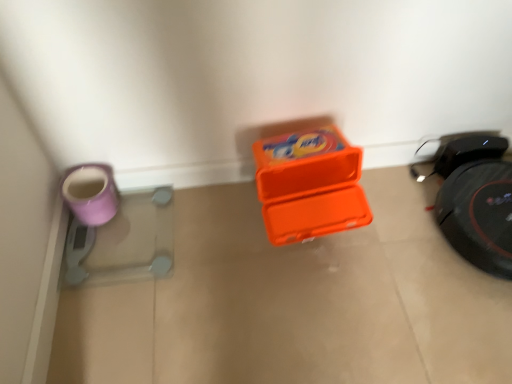
Describe the element at coordinates (294, 303) in the screenshot. This screenshot has height=384, width=512. I see `orange plastic container at center` at that location.

Image resolution: width=512 pixels, height=384 pixels. I want to click on orange plastic container at center, so click(294, 303).

Measure the distance between point [76,201] and camera.

They are 1.14 meters apart.

In order to click on matte purple mug at left in this screenshot , I will do `click(91, 193)`.

This screenshot has height=384, width=512. What do you see at coordinates (91, 193) in the screenshot?
I see `matte purple mug at left` at bounding box center [91, 193].

Identify the location of orange plastic container at center. (294, 303).

Does matte purple mug at left appear on the right side of orange plastic container at center?

Incorrect, matte purple mug at left is not on the right side of orange plastic container at center.

Between matte purple mug at left and orange plastic container at center, which one is positioned in front?

orange plastic container at center is in front.

Does point (93, 211) come behind point (159, 320)?

Yes, point (93, 211) is farther from viewer.

From the image's perspective, does matte purple mug at left appear higher than orange plastic container at center?

Indeed, from the image's perspective, matte purple mug at left is shown above orange plastic container at center.

From a real-world perspective, relative to orange plastic container at center, is matte purple mug at left vertically above or below?

In terms of real-world spatial position, matte purple mug at left is above orange plastic container at center.

Considering the relative sizes of matte purple mug at left and orange plastic container at center in the image provided, is matte purple mug at left wider than orange plastic container at center?

Incorrect, the width of matte purple mug at left does not surpass that of orange plastic container at center.

Who is taller, matte purple mug at left or orange plastic container at center?

matte purple mug at left is taller.

Does matte purple mug at left have a smaller size compared to orange plastic container at center?

Indeed, matte purple mug at left has a smaller size compared to orange plastic container at center.

Would you say matte purple mug at left is outside orange plastic container at center?

matte purple mug at left is positioned outside orange plastic container at center.

Would you consider matte purple mug at left to be distant from orange plastic container at center?

Actually, matte purple mug at left and orange plastic container at center are a little close together.

Is matte purple mug at left turned away from orange plastic container at center?

matte purple mug at left is not turned away from orange plastic container at center.

Identify the location of footwear above the orange plastic container at center (from a real-world perspective). This screenshot has width=512, height=384. (91, 193).

From the picture: Considering the positions of objects orange plastic container at center and matte purple mug at left in the image provided, who is more to the right, orange plastic container at center or matte purple mug at left?

Positioned to the right is orange plastic container at center.

Which is in front, orange plastic container at center or matte purple mug at left?

Positioned in front is orange plastic container at center.

Considering the points (145, 331) and (81, 201), which point is behind, point (145, 331) or point (81, 201)?

Point (81, 201)

From the image's perspective, is orange plastic container at center located above or below matte purple mug at left?

From the image's perspective, orange plastic container at center appears below matte purple mug at left.

From a real-world perspective, is orange plastic container at center physically below matte purple mug at left?

Yes, from a real-world perspective, orange plastic container at center is below matte purple mug at left.

Can you confirm if orange plastic container at center is thinner than matte purple mug at left?

In fact, orange plastic container at center might be wider than matte purple mug at left.

Can you confirm if orange plastic container at center is taller than matte purple mug at left?

In fact, orange plastic container at center may be shorter than matte purple mug at left.

Considering the sizes of objects orange plastic container at center and matte purple mug at left in the image provided, who is smaller, orange plastic container at center or matte purple mug at left?

matte purple mug at left is smaller.

Consider the image. Is matte purple mug at left located within orange plastic container at center?

No, matte purple mug at left is not a part of orange plastic container at center.

Is orange plastic container at center positioned far away from matte purple mug at left?

No, orange plastic container at center is not far away from matte purple mug at left.

Could you tell me if orange plastic container at center is facing matte purple mug at left?

No, orange plastic container at center does not turn towards matte purple mug at left.

How far apart are orange plastic container at center and matte purple mug at left?

50.37 centimeters.

Image resolution: width=512 pixels, height=384 pixels. I want to click on concrete lying below the matte purple mug at left (from the image's perspective), so click(x=294, y=303).

You are a GUI agent. You are given a task and a screenshot of the screen. Output one action in this format:
    pyautogui.click(x=<x>, y=<y>)
    Task: Click on the concrete below the matte purple mug at left (from a real-world perspective)
    
    Given the screenshot: What is the action you would take?
    click(x=294, y=303)

Image resolution: width=512 pixels, height=384 pixels. In the image, there is a orange plastic container at center. What are the coordinates of `footwear above it (from the image's perspective)` in the screenshot? It's located at (91, 193).